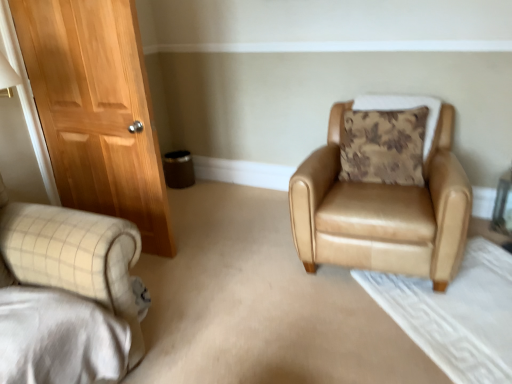
Question: Considering the relative sizes of tan leather armchair at center-right and brown floral cushion at upper right in the image provided, is tan leather armchair at center-right wider than brown floral cushion at upper right?

Choices:
 (A) no
 (B) yes

Answer: (B)

Question: Does tan leather armchair at center-right have a greater height compared to brown floral cushion at upper right?

Choices:
 (A) no
 (B) yes

Answer: (B)

Question: Could you tell me if tan leather armchair at center-right is turned towards brown floral cushion at upper right?

Choices:
 (A) no
 (B) yes

Answer: (A)

Question: From a real-world perspective, is tan leather armchair at center-right below brown floral cushion at upper right?

Choices:
 (A) no
 (B) yes

Answer: (B)

Question: Is tan leather armchair at center-right looking in the opposite direction of brown floral cushion at upper right?

Choices:
 (A) no
 (B) yes

Answer: (B)

Question: Is tan leather armchair at center-right not close to brown floral cushion at upper right?

Choices:
 (A) no
 (B) yes

Answer: (A)

Question: Is brown floral cushion at upper right smaller than tan leather armchair at center-right?

Choices:
 (A) no
 (B) yes

Answer: (B)

Question: Is brown floral cushion at upper right outside of tan leather armchair at center-right?

Choices:
 (A) yes
 (B) no

Answer: (B)

Question: From the image's perspective, is brown floral cushion at upper right beneath tan leather armchair at center-right?

Choices:
 (A) no
 (B) yes

Answer: (A)

Question: From a real-world perspective, is brown floral cushion at upper right over tan leather armchair at center-right?

Choices:
 (A) no
 (B) yes

Answer: (B)

Question: From the image's perspective, is brown floral cushion at upper right on tan leather armchair at center-right?

Choices:
 (A) yes
 (B) no

Answer: (A)

Question: Is brown floral cushion at upper right to the left of tan leather armchair at center-right from the viewer's perspective?

Choices:
 (A) yes
 (B) no

Answer: (B)

Question: Does point (406, 165) appear closer or farther from the camera than point (320, 221)?

Choices:
 (A) closer
 (B) farther

Answer: (B)